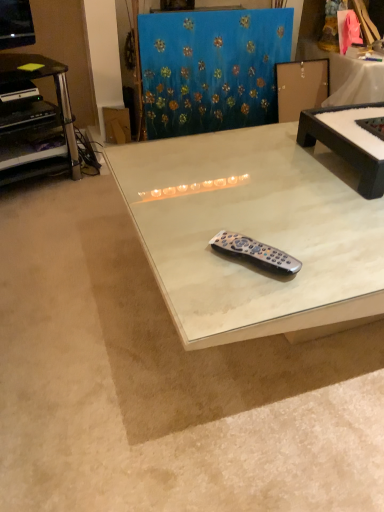
Locate an element on the screen. The height and width of the screenshot is (512, 384). free space to the left of black matte table at center, the 1th table in the right-to-left sequence is located at coordinates (265, 168).